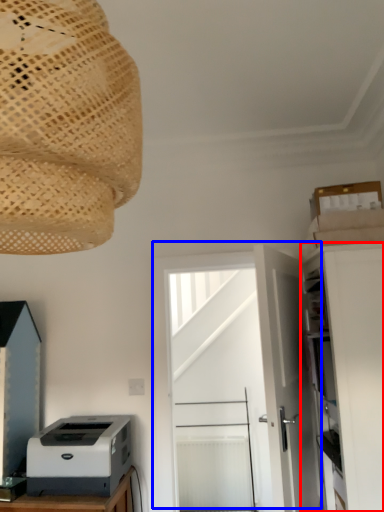
Question: Which object is closer to the camera taking this photo, cabinetry (highlighted by a red box) or door (highlighted by a blue box)?

Choices:
 (A) cabinetry
 (B) door

Answer: (A)